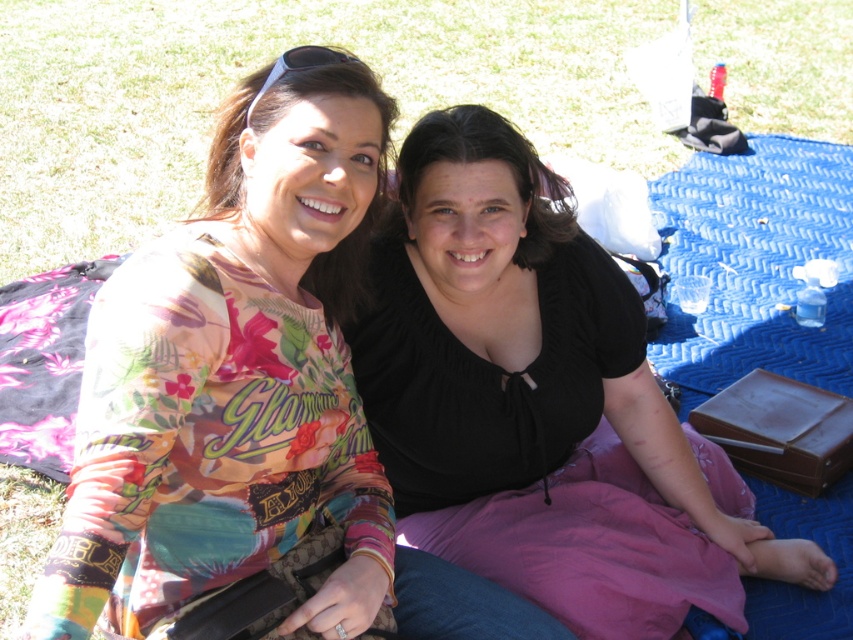
Is floral printed shirt at center above black satin blouse at center?

Correct, floral printed shirt at center is located above black satin blouse at center.

Is floral printed shirt at center positioned in front of black satin blouse at center?

That is True.

Does point (120, 541) lie behind point (605, 292)?

No, (120, 541) is in front of (605, 292).

This screenshot has height=640, width=853. Find the location of `floral printed shirt at center`. floral printed shirt at center is located at coordinates (250, 392).

Between black satin blouse at center and pink floral fabric at left, which one is positioned lower?

black satin blouse at center is below.

Does black satin blouse at center have a lesser height compared to pink floral fabric at left?

In fact, black satin blouse at center may be taller than pink floral fabric at left.

Is point (477, 356) farther from camera compared to point (28, 289)?

No, it is in front of (28, 289).

Identify the location of black satin blouse at center. The width and height of the screenshot is (853, 640). point(515,342).

Between green grass at upper left and black satin blouse at center, which one is positioned lower?

black satin blouse at center is lower down.

Which is more to the left, green grass at upper left or black satin blouse at center?

Positioned to the left is black satin blouse at center.

Who is more forward, (154, 116) or (604, 296)?

Point (604, 296) is in front.

You are a GUI agent. You are given a task and a screenshot of the screen. Output one action in this format:
    pyautogui.click(x=<x>, y=<y>)
    Task: Click on the green grass at upper left
    This screenshot has width=853, height=640.
    Given the screenshot: What is the action you would take?
    pyautogui.click(x=260, y=65)